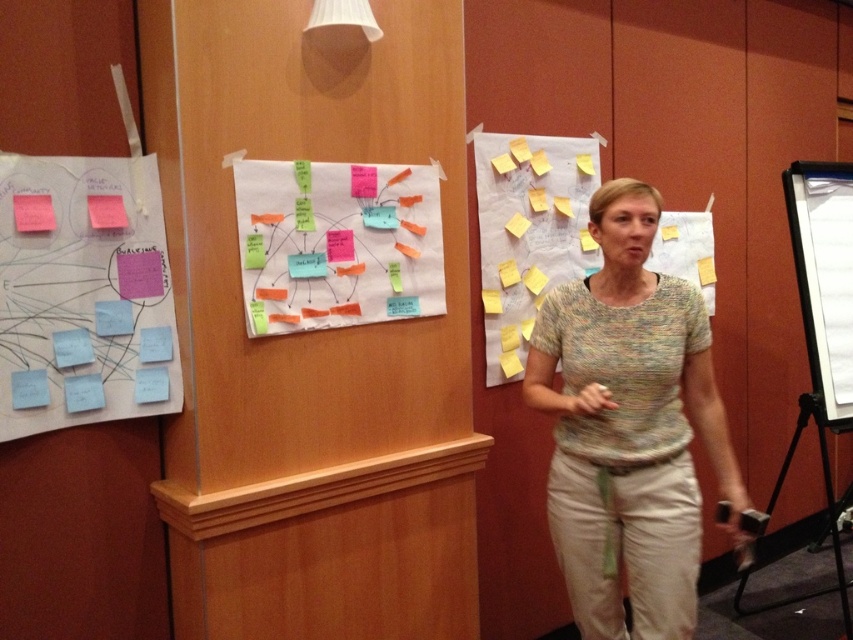
Question: Does blue matte sticky notes at left come behind multicolored sticky notes at center?

Choices:
 (A) yes
 (B) no

Answer: (B)

Question: Is the position of multicolored knit sweater at center more distant than that of yellow paper at upper right?

Choices:
 (A) no
 (B) yes

Answer: (A)

Question: Based on their relative distances, which object is farther from the blue matte sticky notes at left?

Choices:
 (A) multicolored sticky notes at center
 (B) multicolored knit sweater at center
 (C) yellow paper at upper right

Answer: (C)

Question: Which object is positioned closest to the multicolored knit sweater at center?

Choices:
 (A) yellow paper at upper right
 (B) multicolored sticky notes at center

Answer: (B)

Question: Based on their relative distances, which object is nearer to the blue matte sticky notes at left?

Choices:
 (A) multicolored sticky notes at center
 (B) multicolored knit sweater at center

Answer: (A)

Question: Is multicolored sticky notes at center smaller than yellow paper at upper right?

Choices:
 (A) yes
 (B) no

Answer: (A)